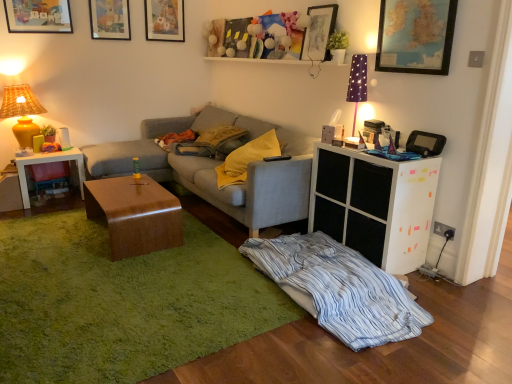
Question: Is matte yellow ceramic lamp at left, the 2th table lamp in the right-to-left sequence, taller than purple fabric lampshade at upper right, placed as the first table lamp when sorted from right to left?

Choices:
 (A) yes
 (B) no

Answer: (A)

Question: From the image's perspective, is matte yellow ceramic lamp at left, which is the 2th table lamp in front-to-back order, located above purple fabric lampshade at upper right, placed as the first table lamp when sorted from right to left?

Choices:
 (A) no
 (B) yes

Answer: (B)

Question: Does matte yellow ceramic lamp at left, the first table lamp in the back-to-front sequence, turn towards purple fabric lampshade at upper right, which appears as the 2th table lamp when viewed from the left?

Choices:
 (A) yes
 (B) no

Answer: (B)

Question: Considering the relative sizes of matte yellow ceramic lamp at left, which is the 2th table lamp in front-to-back order, and purple fabric lampshade at upper right, positioned as the second table lamp in back-to-front order, in the image provided, is matte yellow ceramic lamp at left, which is the 2th table lamp in front-to-back order, wider than purple fabric lampshade at upper right, positioned as the second table lamp in back-to-front order,?

Choices:
 (A) no
 (B) yes

Answer: (B)

Question: Is matte yellow ceramic lamp at left, the 2th table lamp in the right-to-left sequence, next to purple fabric lampshade at upper right, which appears as the 2th table lamp when viewed from the left, and touching it?

Choices:
 (A) yes
 (B) no

Answer: (B)

Question: Considering the relative sizes of matte yellow ceramic lamp at left, the 2th table lamp in the right-to-left sequence, and purple fabric lampshade at upper right, which appears as the 2th table lamp when viewed from the left, in the image provided, is matte yellow ceramic lamp at left, the 2th table lamp in the right-to-left sequence, shorter than purple fabric lampshade at upper right, which appears as the 2th table lamp when viewed from the left,?

Choices:
 (A) yes
 (B) no

Answer: (B)

Question: Does matte yellow ceramic lamp at left, the first table lamp when ordered from left to right, appear on the right side of glossy wood coffee table at center?

Choices:
 (A) yes
 (B) no

Answer: (B)

Question: Does matte yellow ceramic lamp at left, the first table lamp in the back-to-front sequence, have a larger size compared to glossy wood coffee table at center?

Choices:
 (A) yes
 (B) no

Answer: (B)

Question: Is matte yellow ceramic lamp at left, the 2th table lamp in the right-to-left sequence, located outside glossy wood coffee table at center?

Choices:
 (A) yes
 (B) no

Answer: (A)

Question: Is matte yellow ceramic lamp at left, the first table lamp in the back-to-front sequence, wider than glossy wood coffee table at center?

Choices:
 (A) no
 (B) yes

Answer: (A)

Question: Is glossy wood coffee table at center a part of matte yellow ceramic lamp at left, which is the 2th table lamp in front-to-back order?

Choices:
 (A) no
 (B) yes

Answer: (A)

Question: Is the position of matte yellow ceramic lamp at left, which is the 2th table lamp in front-to-back order, more distant than that of glossy wood coffee table at center?

Choices:
 (A) yes
 (B) no

Answer: (A)

Question: Is matte wooden picture frame at upper left, the first picture frame positioned from the left, at the left side of matte wooden picture frame at upper center, arranged as the third picture frame when viewed from the left?

Choices:
 (A) yes
 (B) no

Answer: (A)